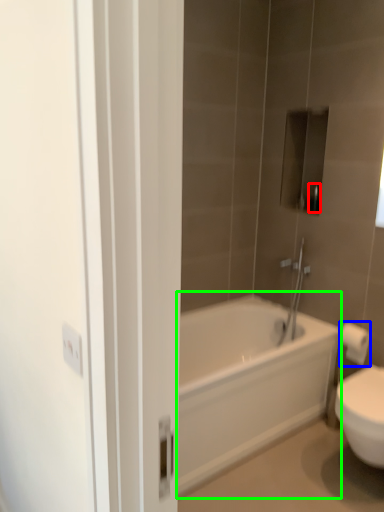
Question: Considering the real-world distances, which object is farthest from toiletry (highlighted by a red box)? toilet paper (highlighted by a blue box) or bathtub (highlighted by a green box)?

Choices:
 (A) toilet paper
 (B) bathtub

Answer: (B)